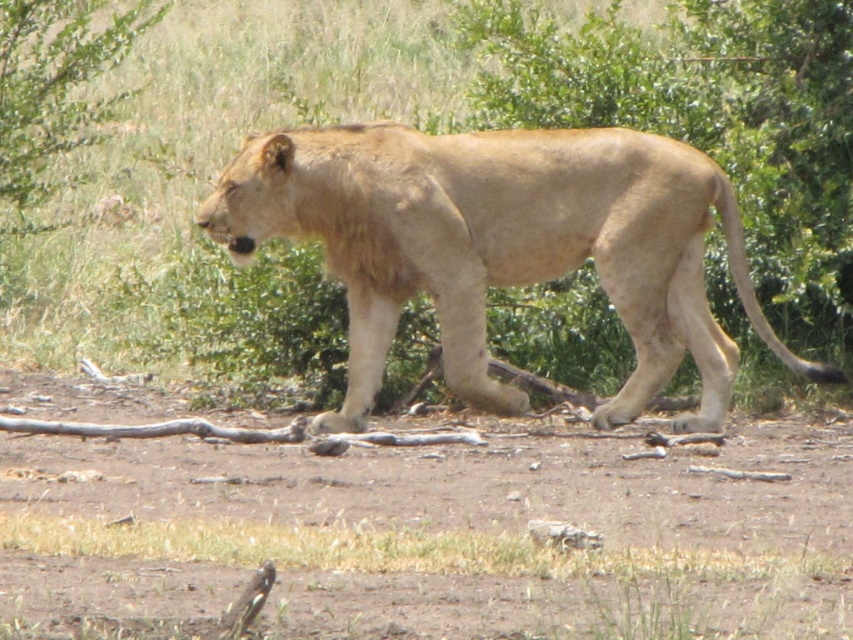
Question: Which object is the farthest from the brown dirt field at center?

Choices:
 (A) light brown fur at center
 (B) green leafy bush at upper left

Answer: (B)

Question: Is brown dirt field at center below light brown fur at center?

Choices:
 (A) no
 (B) yes

Answer: (B)

Question: Which is nearer to the brown dirt field at center?

Choices:
 (A) light brown fur at center
 (B) green leafy bush at upper left

Answer: (A)

Question: Which point appears closest to the camera in this image?

Choices:
 (A) (461, 456)
 (B) (73, 100)
 (C) (729, 202)

Answer: (A)

Question: Does brown dirt field at center appear on the left side of green leafy bush at upper left?

Choices:
 (A) no
 (B) yes

Answer: (A)

Question: Considering the relative positions of light brown fur at center and green leafy bush at upper left in the image provided, where is light brown fur at center located with respect to green leafy bush at upper left?

Choices:
 (A) left
 (B) right

Answer: (B)